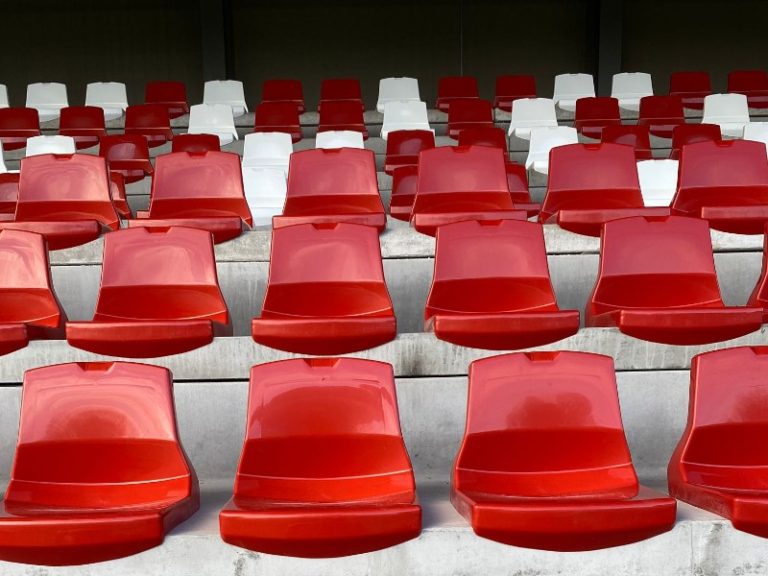
The height and width of the screenshot is (576, 768). I want to click on seats in the third row, so click(x=65, y=204), click(x=207, y=196), click(x=339, y=191), click(x=477, y=191), click(x=604, y=194), click(x=753, y=168).